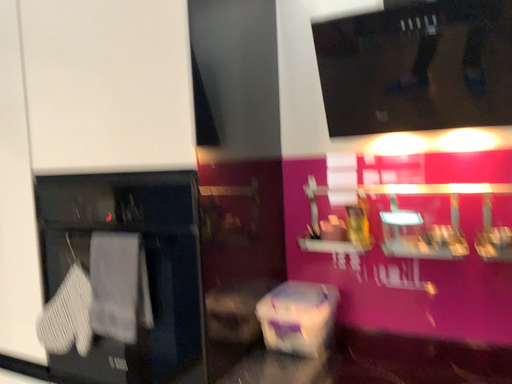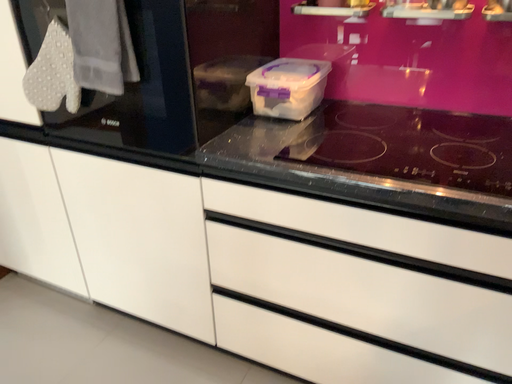
Question: How did the camera likely rotate when shooting the video?

Choices:
 (A) rotated upward
 (B) rotated downward

Answer: (B)